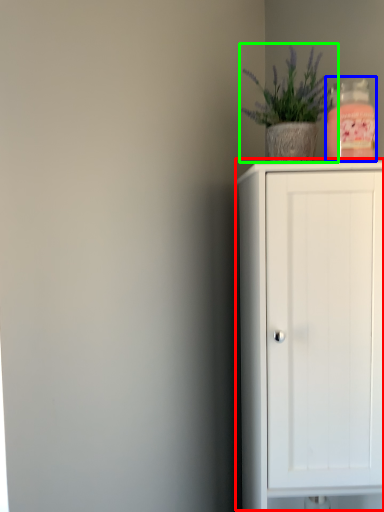
Question: Which object is positioned farthest from cupboard (highlighted by a red box)? Select from bottle (highlighted by a blue box) and houseplant (highlighted by a green box).

Choices:
 (A) bottle
 (B) houseplant

Answer: (B)